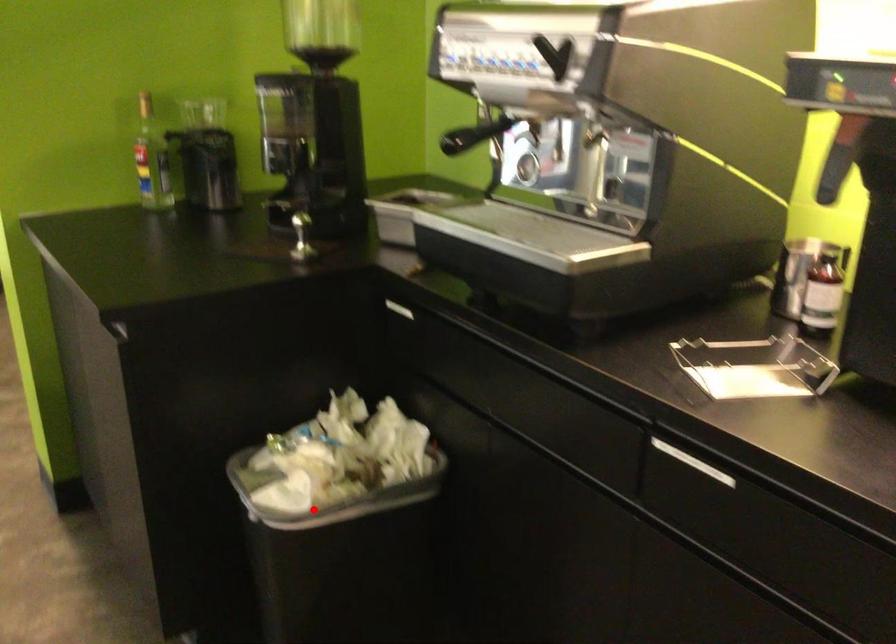
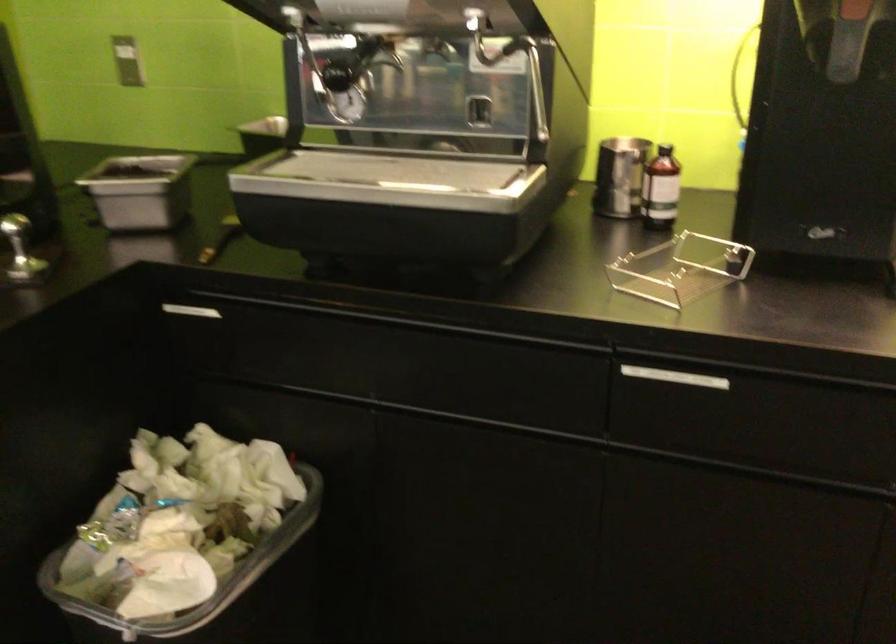
Question: I am providing you with two images of the same scene from different viewpoints. In image1, a red point is highlighted. Considering the same 3D point in image2, which of the following is correct?

Choices:
 (A) It is closer
 (B) It is farther

Answer: (A)